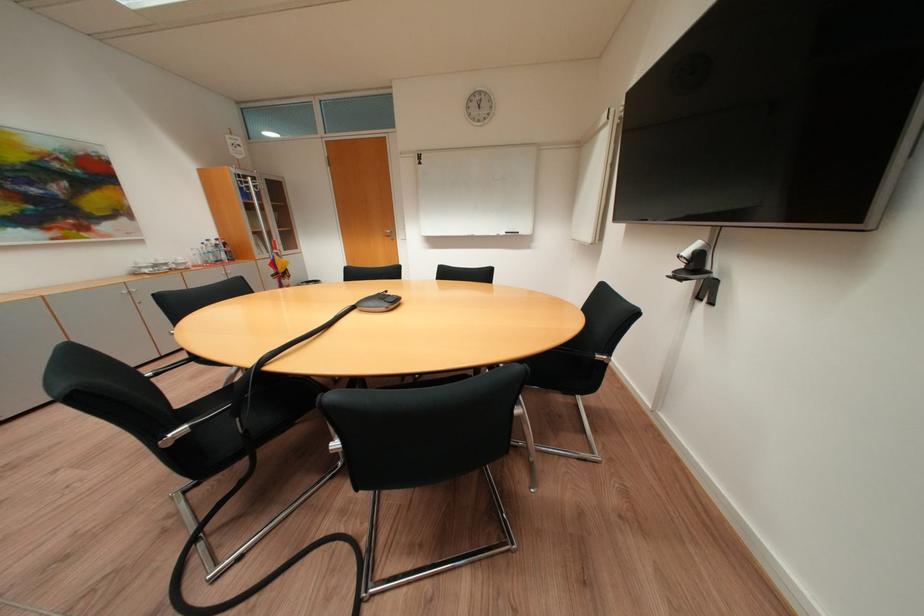
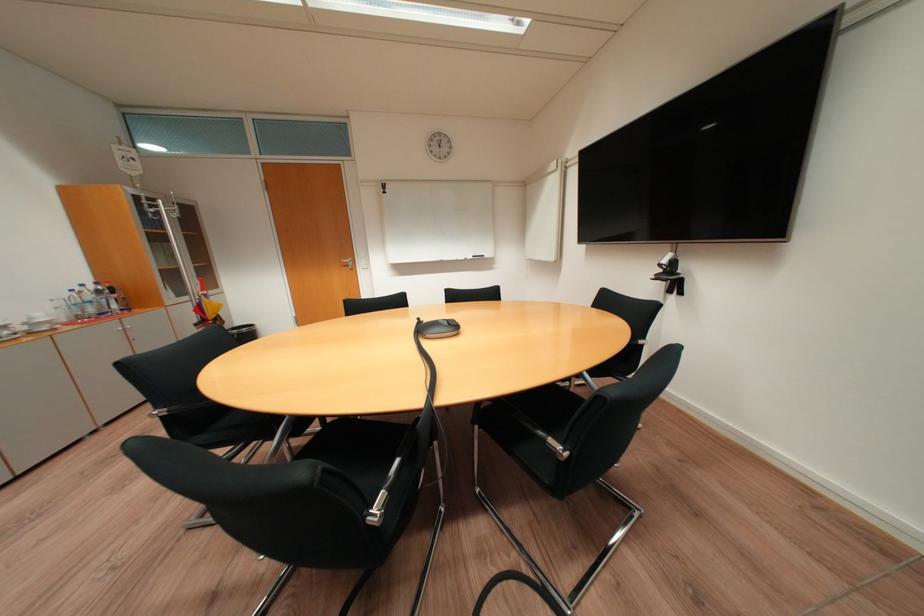
The point at (223, 243) is marked in the first image. Where is the corresponding point in the second image?

(101, 288)